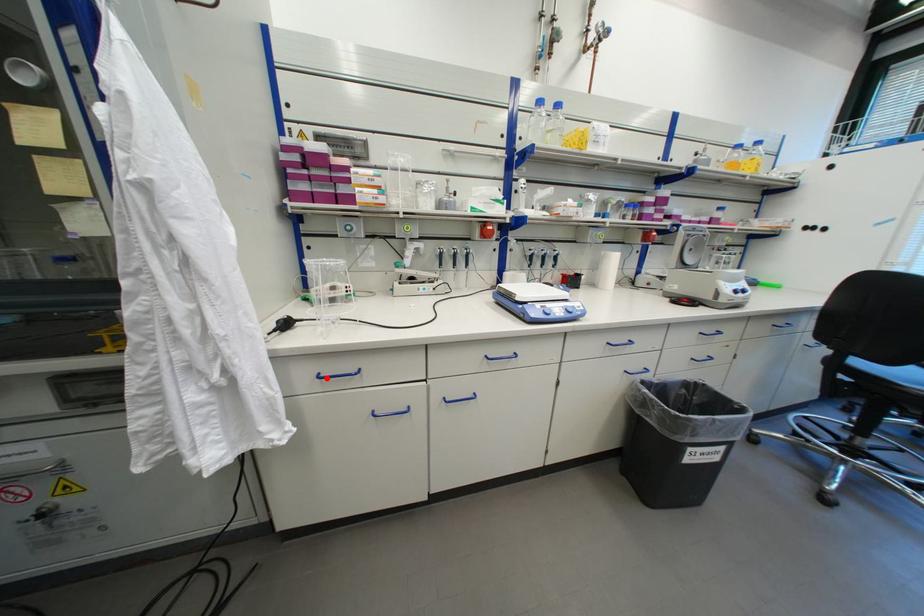
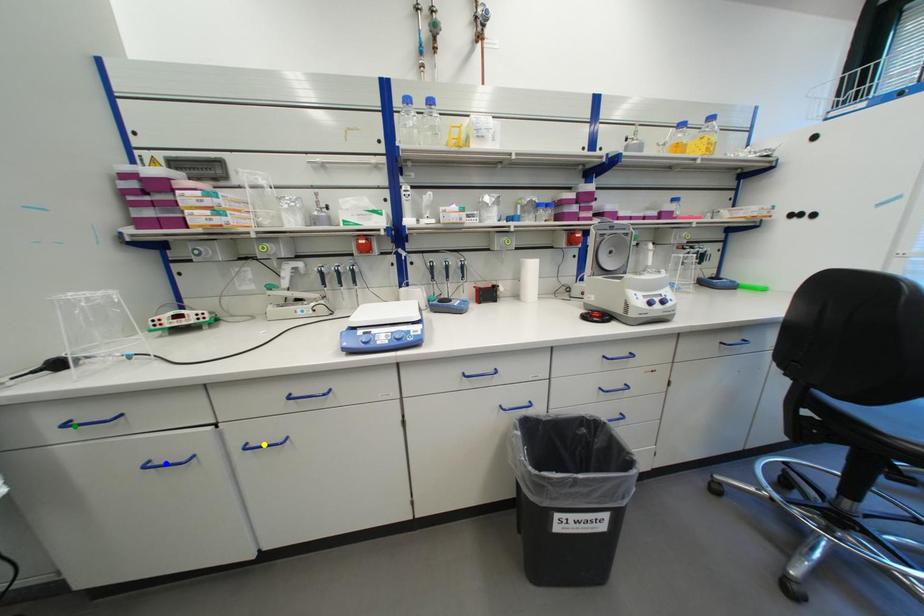
Question: I am providing you with two images of the same scene from different viewpoints. A red point is marked on the first image. You are given multiple points on the second image. In image 2, which mark is for the same physical point as the one in image 1?

Choices:
 (A) yellow point
 (B) green point
 (C) blue point

Answer: (B)